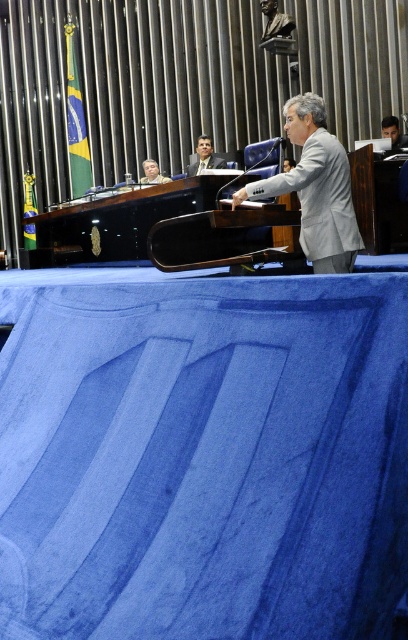
Question: Which of these objects is positioned farthest from the matte black suit at upper center?

Choices:
 (A) matte black laptop at upper right
 (B) blue fabric ramp at center
 (C) matte black laptop at upper center

Answer: (B)

Question: Which point is farther to the camera?

Choices:
 (A) gray fabric at center
 (B) matte black suit at upper center
 (C) matte black laptop at upper right
 (D) matte black laptop at upper center

Answer: (D)

Question: Considering the relative positions of blue fabric ramp at center and gray fabric at center in the image provided, where is blue fabric ramp at center located with respect to gray fabric at center?

Choices:
 (A) right
 (B) left

Answer: (B)

Question: Is matte black suit at upper center further to the viewer compared to matte black laptop at upper right?

Choices:
 (A) yes
 (B) no

Answer: (A)

Question: Does matte black laptop at upper right appear on the left side of matte black laptop at upper center?

Choices:
 (A) no
 (B) yes

Answer: (A)

Question: Which is farther from the matte black laptop at upper right?

Choices:
 (A) gray fabric at center
 (B) matte black suit at upper center

Answer: (A)